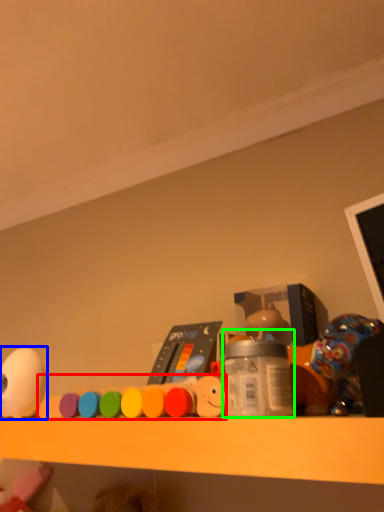
Question: Which object is positioned closest to toy (highlighted by a red box)? Select from toy (highlighted by a blue box) and bottle (highlighted by a green box).

Choices:
 (A) toy
 (B) bottle

Answer: (B)